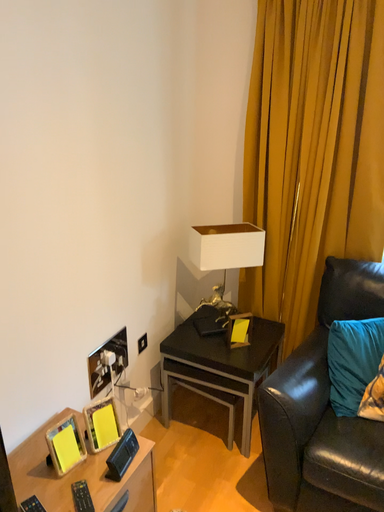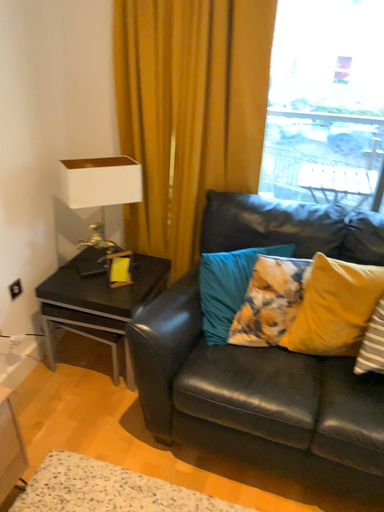
Question: How did the camera likely rotate when shooting the video?

Choices:
 (A) rotated right
 (B) rotated left

Answer: (A)